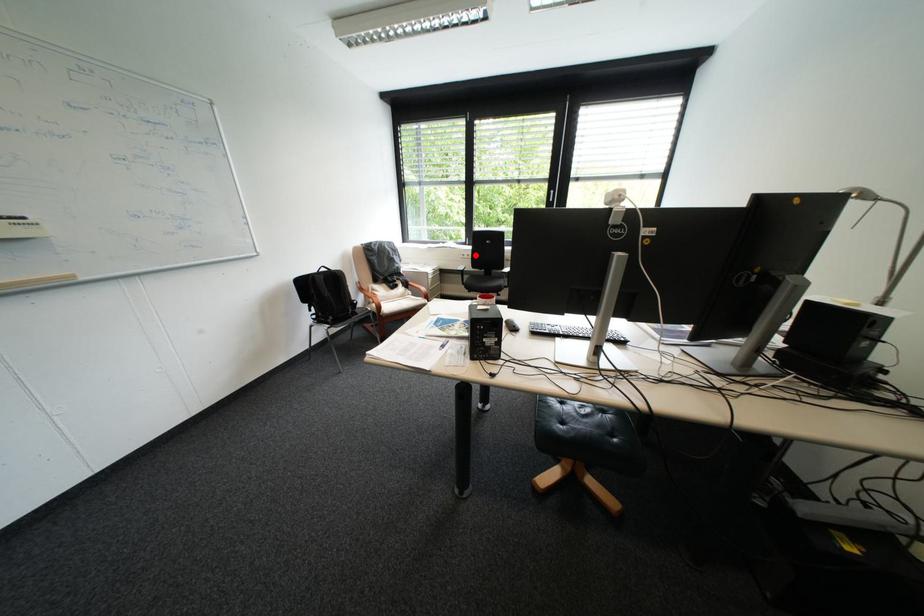
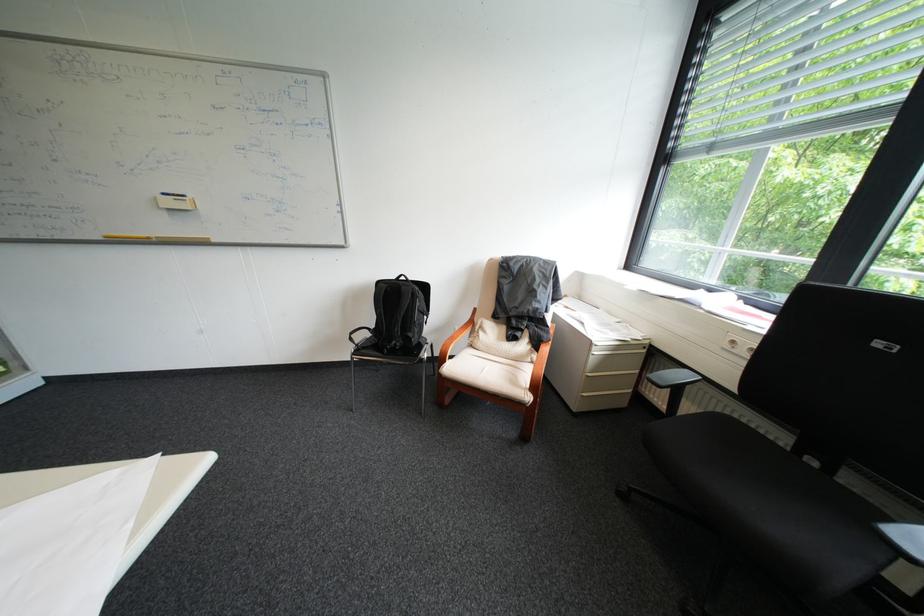
The point at the highlighted location is marked in the first image. Where is the corresponding point in the second image?

(746, 342)